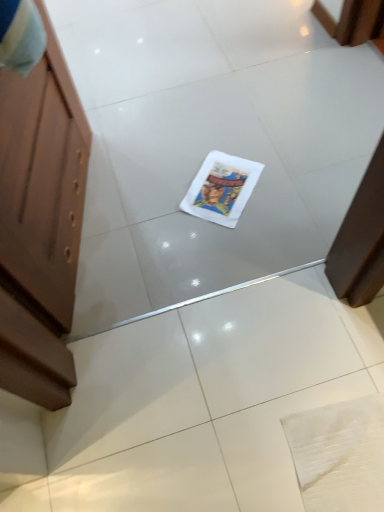
What are the coordinates of `vacant space in front of white paper comic book at center` in the screenshot? It's located at (242, 242).